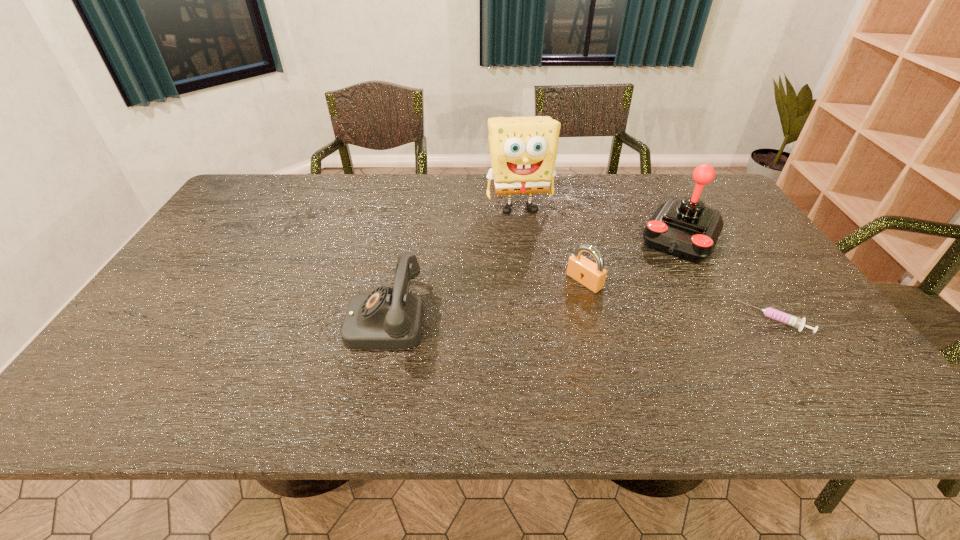
The height and width of the screenshot is (540, 960). Identify the location of the third shortest object. (388, 318).

You are a GUI agent. You are given a task and a screenshot of the screen. Output one action in this format:
    pyautogui.click(x=<x>, y=<y>)
    Task: Click on the leftmost object
    The height and width of the screenshot is (540, 960).
    Given the screenshot: What is the action you would take?
    pyautogui.click(x=388, y=318)

Where is `syringe`? syringe is located at coordinates (x=769, y=312).

This screenshot has height=540, width=960. Identify the location of sponge. (523, 150).

Identify the location of joystick. This screenshot has width=960, height=540. (686, 228).

The width and height of the screenshot is (960, 540). In order to click on padlock in this screenshot , I will do `click(591, 275)`.

This screenshot has height=540, width=960. In order to click on vacant space located on the dial of the leftmost object in this screenshot , I will do [186, 319].

Find the location of a particular element. The height and width of the screenshot is (540, 960). vacant space positioned on the dial of the leftmost object is located at coordinates (268, 319).

Locate an element on the screen. The height and width of the screenshot is (540, 960). free region located on the dial of the leftmost object is located at coordinates (312, 319).

Find the location of a particular element. The height and width of the screenshot is (540, 960). vacant space situated on the left of the shortest object is located at coordinates (608, 320).